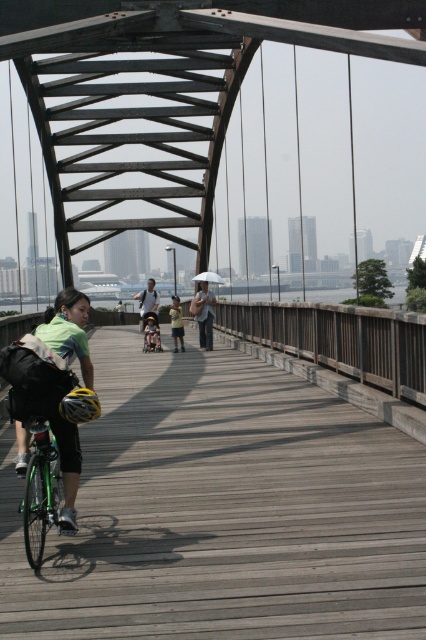
Question: Is light blue shirt at center to the left of green matte bicycle at center from the viewer's perspective?

Choices:
 (A) no
 (B) yes

Answer: (B)

Question: Considering the relative positions of light blue shirt at center and green matte bicycle at center in the image provided, where is light blue shirt at center located with respect to green matte bicycle at center?

Choices:
 (A) above
 (B) below

Answer: (A)

Question: Which of the following is the closest to the observer?

Choices:
 (A) light blue shirt at center
 (B) matte gray jacket at center
 (C) green matte bicycle at center

Answer: (B)

Question: Estimate the real-world distances between objects in this image. Which object is closer to the wooden bridge at center?

Choices:
 (A) light blue shirt at center
 (B) green matte bicycle at left
 (C) green matte bicycle at center
 (D) matte gray jacket at center

Answer: (B)

Question: Does wooden bridge at center have a larger size compared to matte gray jacket at center?

Choices:
 (A) no
 (B) yes

Answer: (B)

Question: Which object appears closest to the camera in this image?

Choices:
 (A) light blue shirt at center
 (B) wooden bridge at center

Answer: (B)